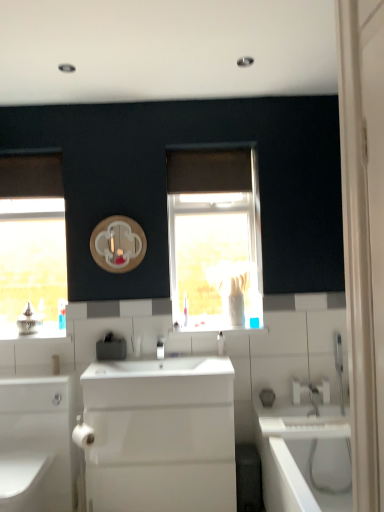
Question: Is white glossy cabinet at lower left not within wooden circle at center?

Choices:
 (A) no
 (B) yes

Answer: (B)

Question: Is white glossy cabinet at lower left positioned with its back to wooden circle at center?

Choices:
 (A) yes
 (B) no

Answer: (B)

Question: Does white glossy cabinet at lower left contain wooden circle at center?

Choices:
 (A) yes
 (B) no

Answer: (B)

Question: Is white glossy cabinet at lower left smaller than wooden circle at center?

Choices:
 (A) yes
 (B) no

Answer: (B)

Question: Can you confirm if white glossy cabinet at lower left is wider than wooden circle at center?

Choices:
 (A) yes
 (B) no

Answer: (A)

Question: Does white glossy cabinet at lower left turn towards wooden circle at center?

Choices:
 (A) no
 (B) yes

Answer: (A)

Question: Is satin black soap dispenser at center turned away from white glossy sink at center?

Choices:
 (A) yes
 (B) no

Answer: (B)

Question: Is satin black soap dispenser at center far from white glossy sink at center?

Choices:
 (A) yes
 (B) no

Answer: (B)

Question: From the image's perspective, is satin black soap dispenser at center beneath white glossy sink at center?

Choices:
 (A) yes
 (B) no

Answer: (B)

Question: Considering the relative sizes of satin black soap dispenser at center and white glossy sink at center in the image provided, is satin black soap dispenser at center wider than white glossy sink at center?

Choices:
 (A) no
 (B) yes

Answer: (A)

Question: Can you confirm if satin black soap dispenser at center is positioned to the right of white glossy sink at center?

Choices:
 (A) yes
 (B) no

Answer: (B)

Question: From a real-world perspective, is satin black soap dispenser at center on top of white glossy sink at center?

Choices:
 (A) yes
 (B) no

Answer: (A)

Question: Is wooden circle at center aimed at satin black soap dispenser at center?

Choices:
 (A) no
 (B) yes

Answer: (A)